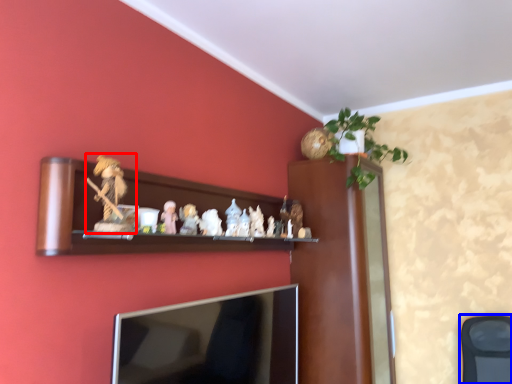
Question: Which object is closer to the camera taking this photo, toy (highlighted by a red box) or swivel chair (highlighted by a blue box)?

Choices:
 (A) toy
 (B) swivel chair

Answer: (A)